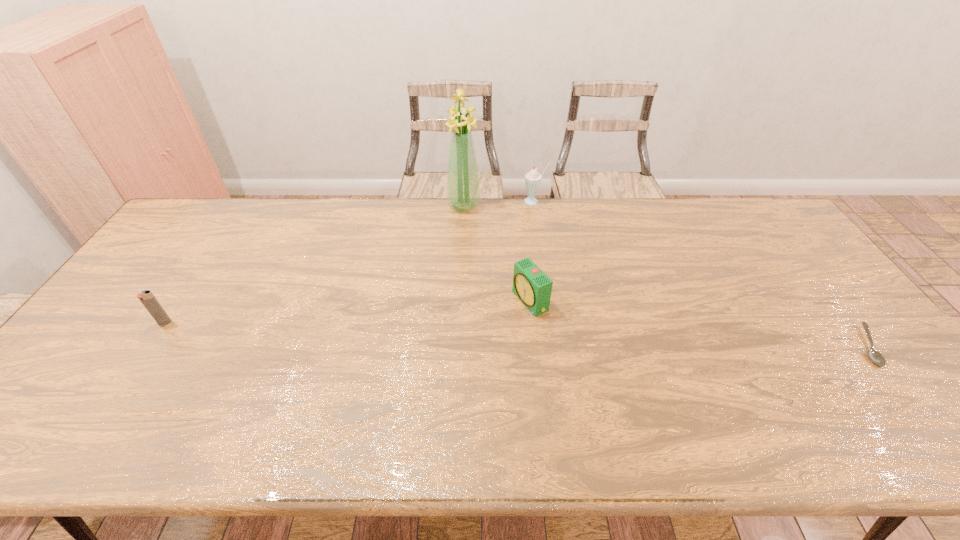
This screenshot has height=540, width=960. What are the coordinates of `igniter` in the screenshot? It's located at (147, 298).

Identify the location of soupspoon. The height and width of the screenshot is (540, 960). (875, 356).

In order to click on the shortest object in this screenshot , I will do `click(875, 356)`.

Image resolution: width=960 pixels, height=540 pixels. Find the location of `alarm clock`. alarm clock is located at coordinates (531, 285).

Identify the location of milkshake. The width and height of the screenshot is (960, 540). (532, 179).

The image size is (960, 540). I want to click on the second object from left to right, so click(463, 189).

This screenshot has width=960, height=540. In order to click on bouquet in this screenshot , I will do `click(463, 189)`.

This screenshot has height=540, width=960. I want to click on vacant area situated on the left of the leftmost object, so click(x=118, y=322).

Locate an element on the screen. Image resolution: width=960 pixels, height=540 pixels. vacant space located on the front of the rightmost object is located at coordinates (908, 397).

At what (x,y) coordinates should I click in order to perform the action: click on vacant space located on the front-facing side of the alarm clock. Please return your answer as a coordinate pair (x, y). Image resolution: width=960 pixels, height=540 pixels. Looking at the image, I should click on [414, 355].